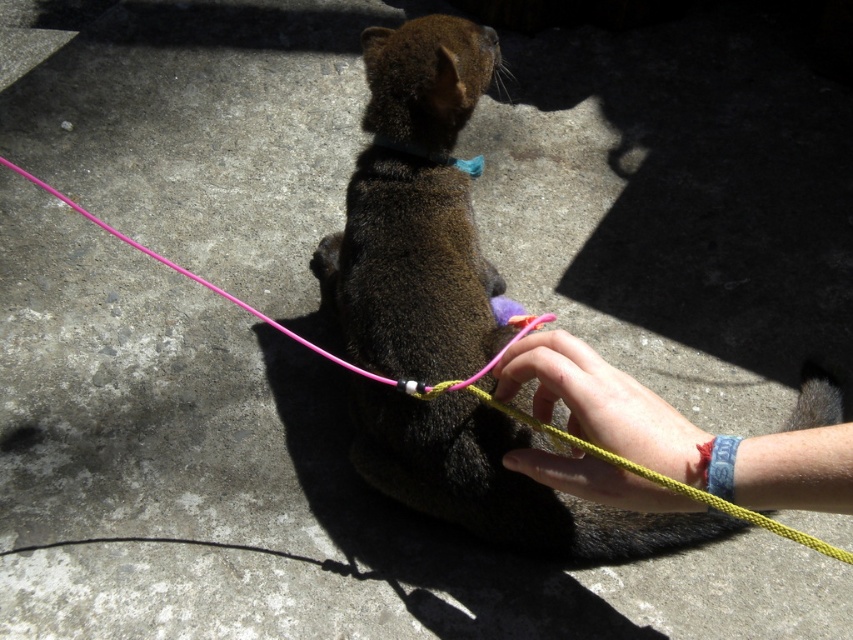
Question: Is pink nylon leash at center below blue fabric neckband at center?

Choices:
 (A) no
 (B) yes

Answer: (B)

Question: Among these objects, which one is nearest to the camera?

Choices:
 (A) blue fabric neckband at center
 (B) smooth yellow rope at center

Answer: (B)

Question: Can you confirm if smooth yellow rope at center is smaller than pink nylon leash at center?

Choices:
 (A) no
 (B) yes

Answer: (B)

Question: Which point is closer to the camera?

Choices:
 (A) pink nylon leash at center
 (B) blue fabric neckband at center
 (C) smooth yellow rope at center

Answer: (A)

Question: Can you confirm if pink nylon leash at center is positioned below blue fabric neckband at center?

Choices:
 (A) yes
 (B) no

Answer: (A)

Question: Based on their relative distances, which object is nearer to the blue fabric neckband at center?

Choices:
 (A) pink nylon leash at center
 (B) smooth yellow rope at center

Answer: (A)